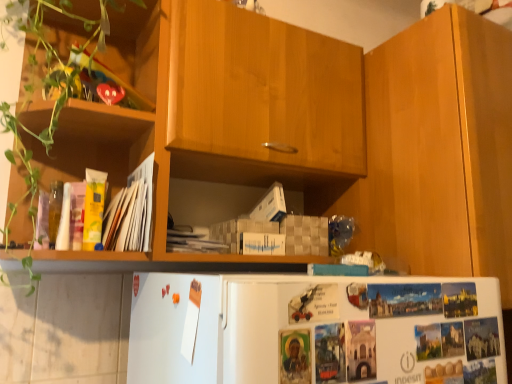
Question: Can you confirm if green matte plant at left is positioned to the right of yellow paper at left?

Choices:
 (A) yes
 (B) no

Answer: (B)

Question: Does green matte plant at left have a smaller size compared to yellow paper at left?

Choices:
 (A) no
 (B) yes

Answer: (A)

Question: From the image's perspective, is green matte plant at left beneath yellow paper at left?

Choices:
 (A) no
 (B) yes

Answer: (A)

Question: Is green matte plant at left completely or partially outside of yellow paper at left?

Choices:
 (A) no
 (B) yes

Answer: (B)

Question: Is yellow paper at left at the back of green matte plant at left?

Choices:
 (A) no
 (B) yes

Answer: (A)

Question: Is wooden cabinet at right bigger or smaller than yellow paper at left?

Choices:
 (A) big
 (B) small

Answer: (A)

Question: From a real-world perspective, relative to yellow paper at left, is wooden cabinet at right vertically above or below?

Choices:
 (A) below
 (B) above

Answer: (B)

Question: Is wooden cabinet at right inside or outside of yellow paper at left?

Choices:
 (A) outside
 (B) inside

Answer: (A)

Question: Would you say wooden cabinet at right is to the left or to the right of yellow paper at left in the picture?

Choices:
 (A) left
 (B) right

Answer: (B)

Question: In the image, is yellow paper at left on the left side or the right side of green matte plant at left?

Choices:
 (A) right
 (B) left

Answer: (A)

Question: From a real-world perspective, is yellow paper at left above or below green matte plant at left?

Choices:
 (A) below
 (B) above

Answer: (A)

Question: From the image's perspective, is yellow paper at left above or below green matte plant at left?

Choices:
 (A) below
 (B) above

Answer: (A)

Question: Is point (148, 243) positioned closer to the camera than point (23, 130)?

Choices:
 (A) closer
 (B) farther

Answer: (A)

Question: Based on their sizes in the image, would you say yellow paper at left is bigger or smaller than wooden cabinet at right?

Choices:
 (A) big
 (B) small

Answer: (B)

Question: Considering the relative positions of yellow paper at left and wooden cabinet at right in the image provided, is yellow paper at left to the left or to the right of wooden cabinet at right?

Choices:
 (A) left
 (B) right

Answer: (A)